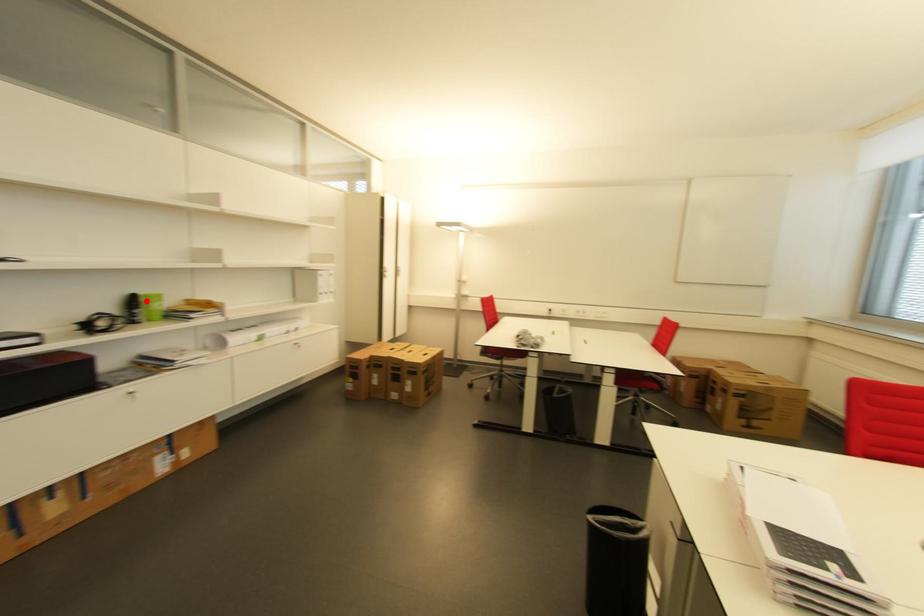
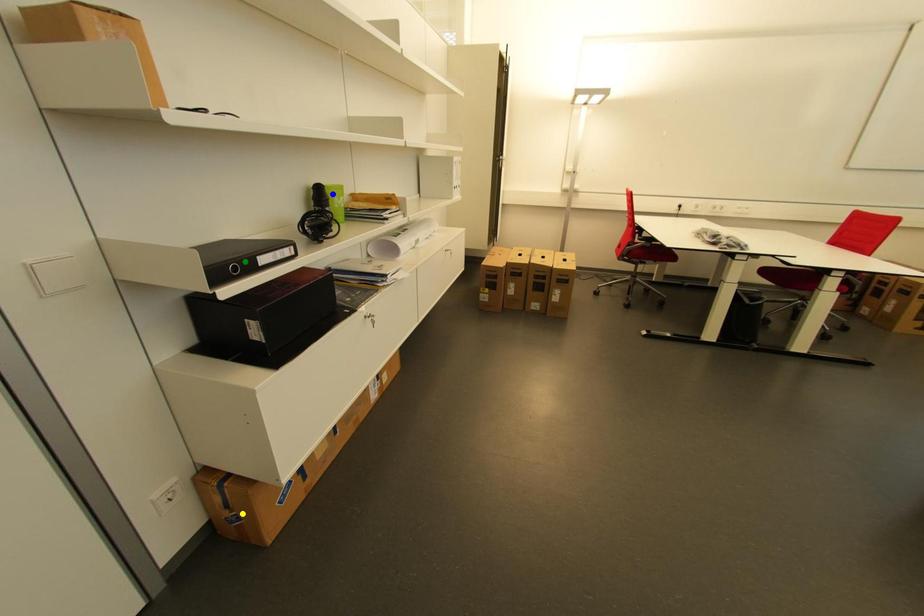
Question: I am providing you with two images of the same scene from different viewpoints. A red point is marked on the first image. You are given multiple points on the second image. Which spot in image 2 lines up with the point in image 1?

Choices:
 (A) blue point
 (B) yellow point
 (C) green point

Answer: (A)